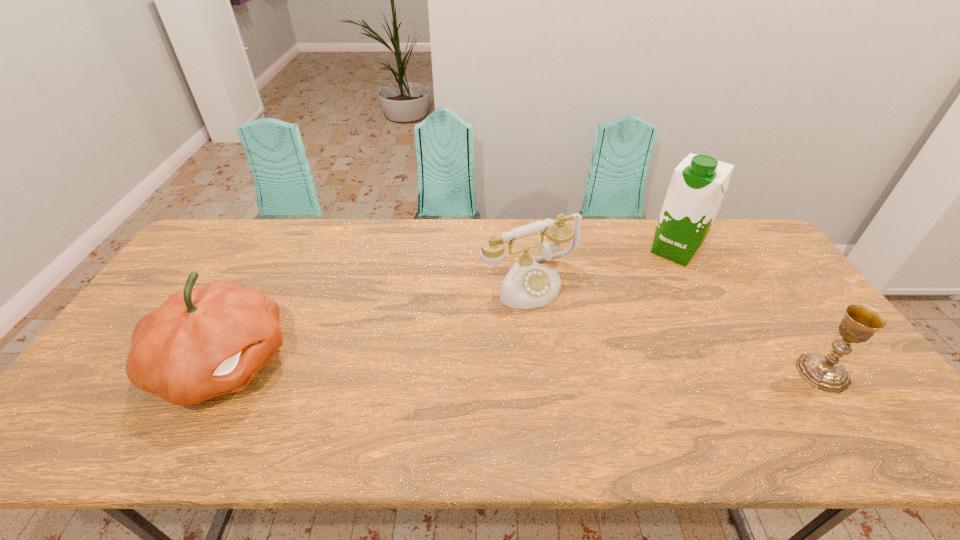
At what (x,y) coordinates should I click in order to perform the action: click on free space on the desktop that is between the leftmost object and the chalice and is positioned on the dial of the telephone. Please return your answer as a coordinate pair (x, y). Image resolution: width=960 pixels, height=540 pixels. Looking at the image, I should click on (604, 369).

You are a GUI agent. You are given a task and a screenshot of the screen. Output one action in this format:
    pyautogui.click(x=<x>, y=<y>)
    Task: Click on the vacant space on the desktop that is between the second tallest object and the rightmost object and is positioned on the front-facing side of the second object from right to left
    The height and width of the screenshot is (540, 960).
    Given the screenshot: What is the action you would take?
    pyautogui.click(x=587, y=369)